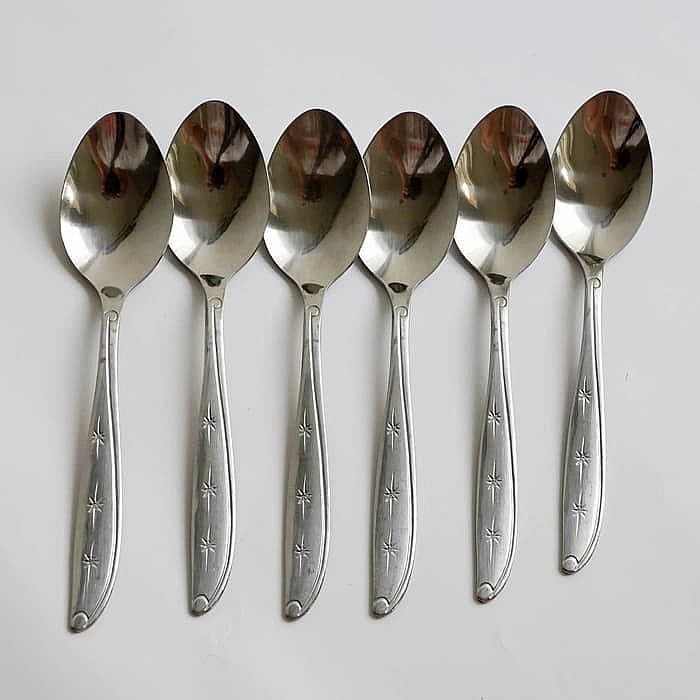
At what (x,y) coordinates should I click in order to perform the action: click on spoons handle. Please return your answer as a coordinate pair (x, y). This screenshot has height=700, width=700. Looking at the image, I should click on (97, 463), (210, 463), (309, 467), (392, 462), (503, 449), (584, 427).